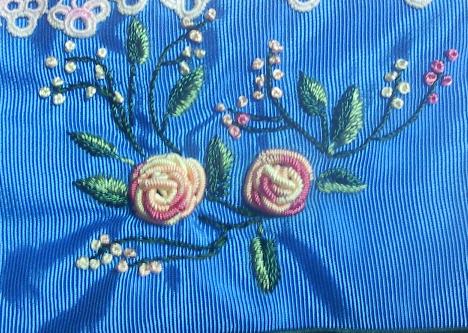
Where is `corner`? This screenshot has width=468, height=333. corner is located at coordinates (456, 323), (16, 324), (14, 11), (463, 9).